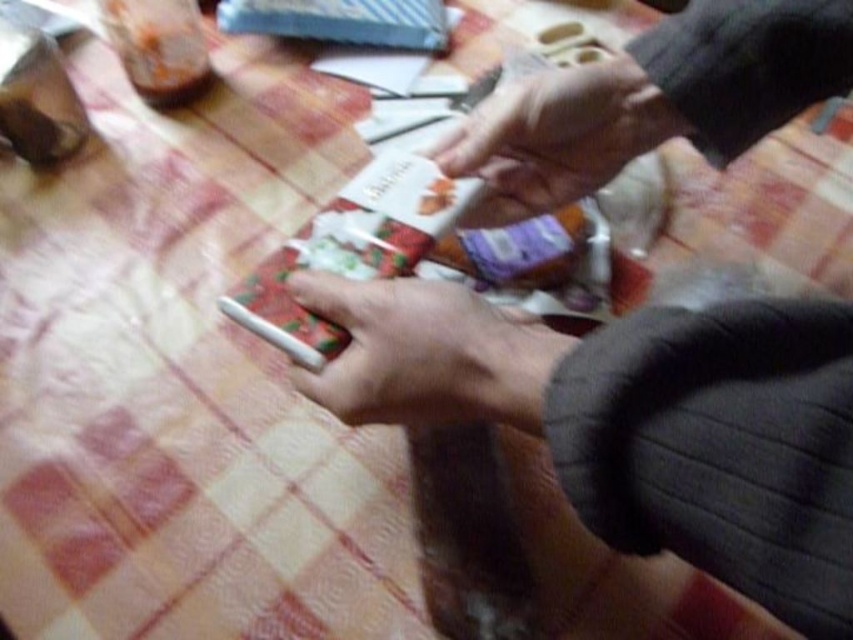
You are a photographer trying to capture a closeup of the white matte cigarette at center. If your camera can focus on objects within 30 centimeters, will you need to adjust your position to get it in focus?

The white matte cigarette at center is 32.26 centimeters away from the camera, which is beyond the 30 centimeter focus range. Therefore, you need to move closer to bring it into focus.

You are organizing items on a table for a gift wrapping station. You have two points marked on the table where items should be placed. According to the image, which point is closer to you, point (548, 356) or point (561, 125)?

Point (548, 356) is in front of point (561, 125), so it is closer to you.

You are a guest at a party and see the white matte cigarette at center and the smooth skin hand at upper center on the table. Which object is thinner?

The white matte cigarette at center is thinner than the smooth skin hand at upper center.